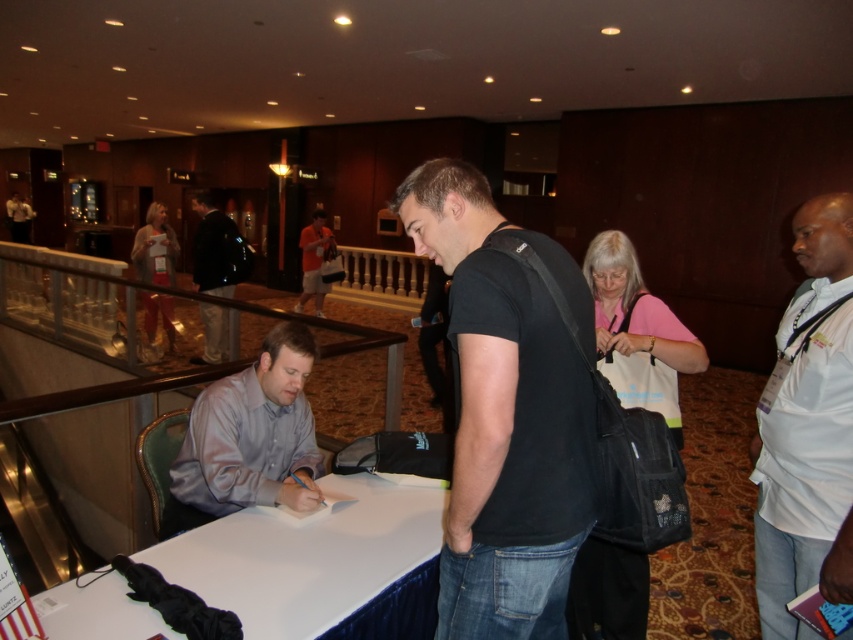
Which is in front, point (813, 337) or point (218, 282)?

Positioned in front is point (813, 337).

Can you confirm if white cotton shirt at right is taller than dark blue jeans at center?

Indeed, white cotton shirt at right has a greater height compared to dark blue jeans at center.

Between point (776, 435) and point (218, 216), which one is positioned in front?

Positioned in front is point (776, 435).

At what (x,y) coordinates should I click in order to perform the action: click on white cotton shirt at right. Please return your answer as a coordinate pair (x, y). The image size is (853, 640). Looking at the image, I should click on (808, 429).

Who is shorter, silky purple shirt at center or dark blue jeans at center?

silky purple shirt at center

Is silky purple shirt at center thinner than dark blue jeans at center?

Indeed, silky purple shirt at center has a lesser width compared to dark blue jeans at center.

Locate an element on the screen. Image resolution: width=853 pixels, height=640 pixels. silky purple shirt at center is located at coordinates (248, 438).

Does white cotton shirt at right appear on the right side of silky purple shirt at center?

Yes, white cotton shirt at right is to the right of silky purple shirt at center.

Does white cotton shirt at right have a greater height compared to silky purple shirt at center?

Correct, white cotton shirt at right is much taller as silky purple shirt at center.

I want to click on white cotton shirt at right, so click(x=808, y=429).